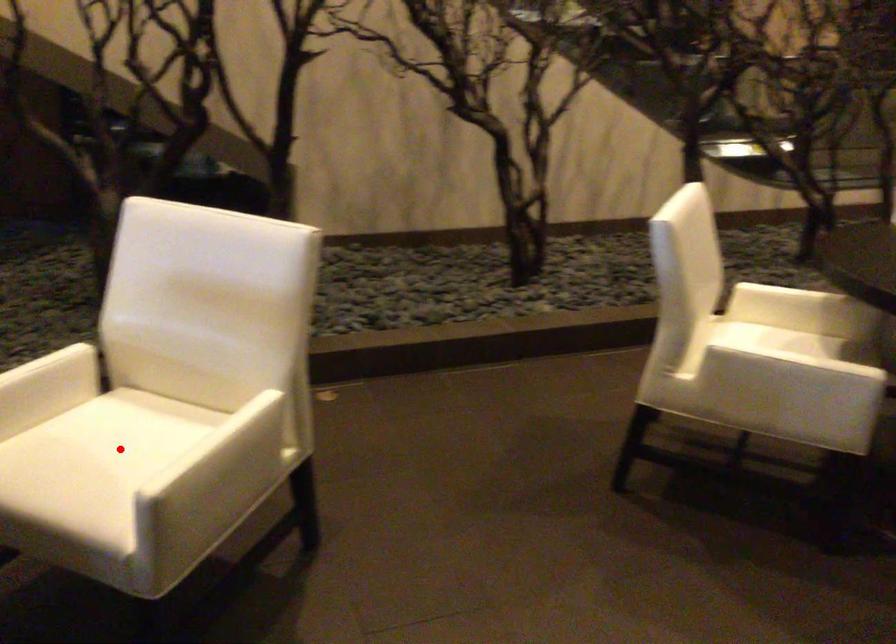
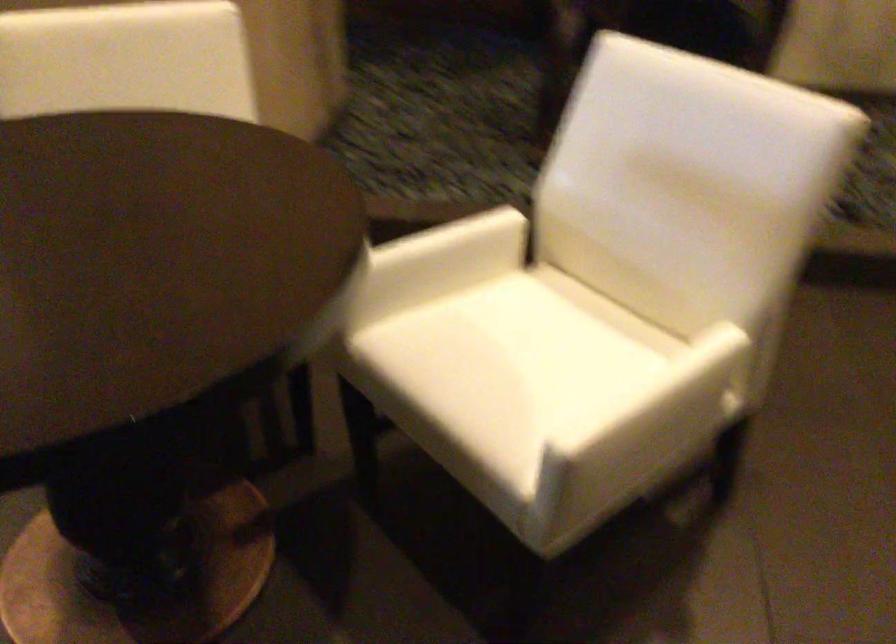
Question: I am providing you with two images of the same scene from different viewpoints. Given a red point in image1, look at the same physical point in image2. Is it:

Choices:
 (A) Closer to the viewpoint
 (B) Farther from the viewpoint

Answer: (A)